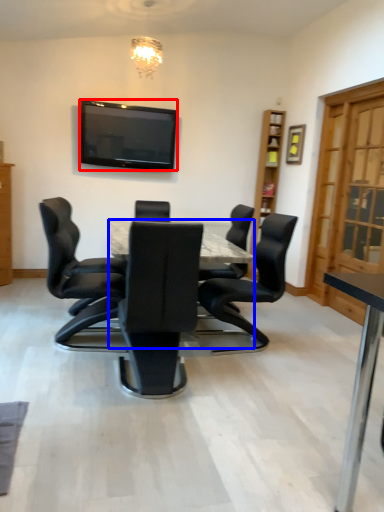
Question: Which of the following is the closest to the observer, television (highlighted by a red box) or desk (highlighted by a blue box)?

Choices:
 (A) television
 (B) desk

Answer: (B)